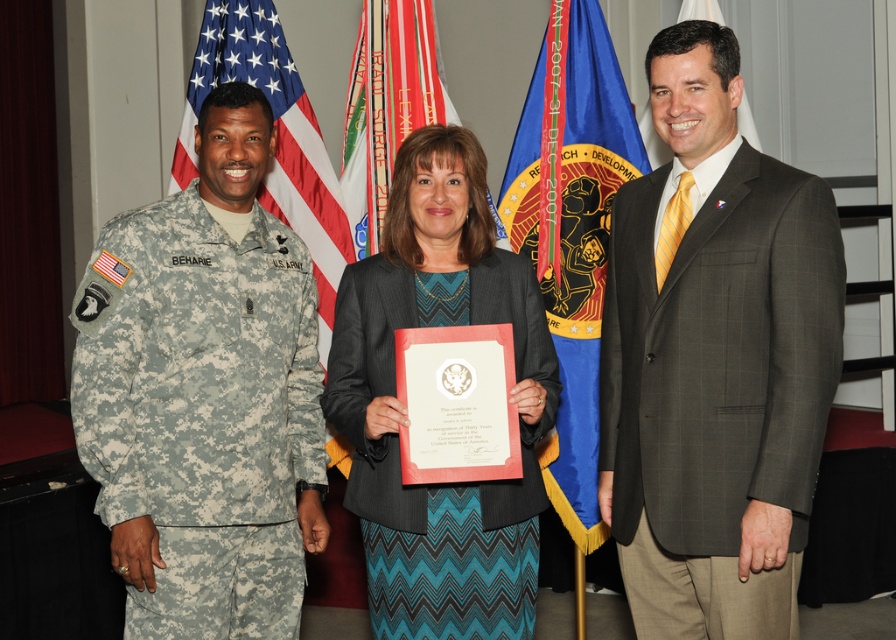
Who is shorter, camouflage fabric uniform at left or blue fabric flag at center?

camouflage fabric uniform at left

Is camouflage fabric uniform at left thinner than blue fabric flag at center?

No.

I want to click on camouflage fabric uniform at left, so click(x=202, y=412).

Is camouflage fabric uniform at left to the left of camouflage fabric uniform at center from the viewer's perspective?

Answer: Yes, camouflage fabric uniform at left is to the left of camouflage fabric uniform at center.

Image resolution: width=896 pixels, height=640 pixels. What are the coordinates of `camouflage fabric uniform at left` in the screenshot? It's located at (202, 412).

Based on the photo, is camouflage fabric uniform at left shorter than blue fabric flag at upper center?

In fact, camouflage fabric uniform at left may be taller than blue fabric flag at upper center.

The height and width of the screenshot is (640, 896). Identify the location of camouflage fabric uniform at left. (202, 412).